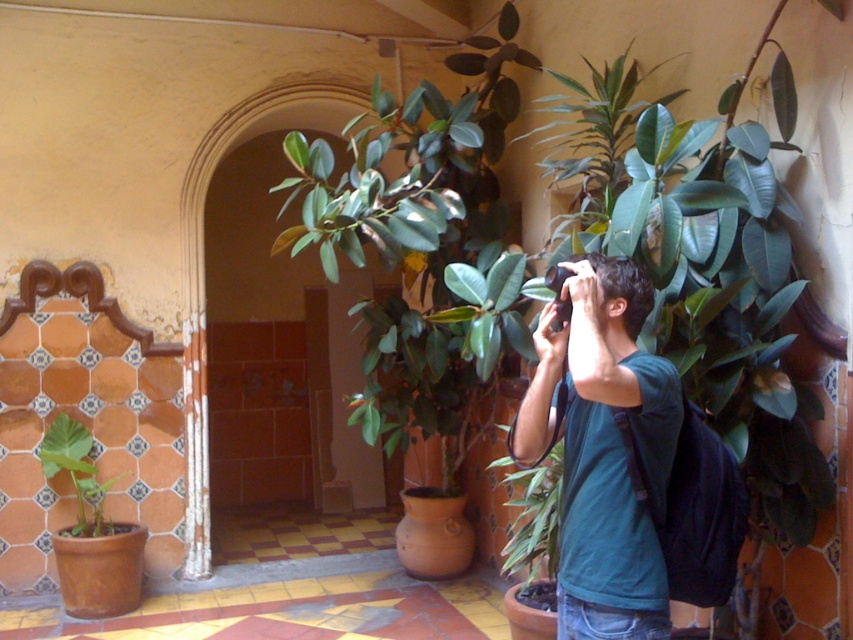
You are a photographer trying to capture a clear shot of the person wearing the green matte shirt at center. However, there is a green leafy plant at center blocking your view. Can you determine which side of the plant you should move to in order to get an unobstructed view of the person?

The green matte shirt at center is positioned on the right side of the green leafy plant at center. To get an unobstructed view, you should move to the right side of the plant.

You are a delivery person standing in the courtyard. You need to place a package that is 3 feet long between the green matte shirt at center and the green leafy plant at center. Is there enough space between them to fit the package?

The distance between the green matte shirt at center and the green leafy plant at center is 34.18 inches. Since 3 feet equals 36 inches, the space is slightly too narrow to fit the 36 inch package comfortably.

You are a security camera monitoring the courtyard. You notice a person wearing a green matte shirt at center and a green matte leafy plant at lower left. Which object is positioned higher in the scene?

The green matte shirt at center is positioned higher than the green matte leafy plant at lower left.